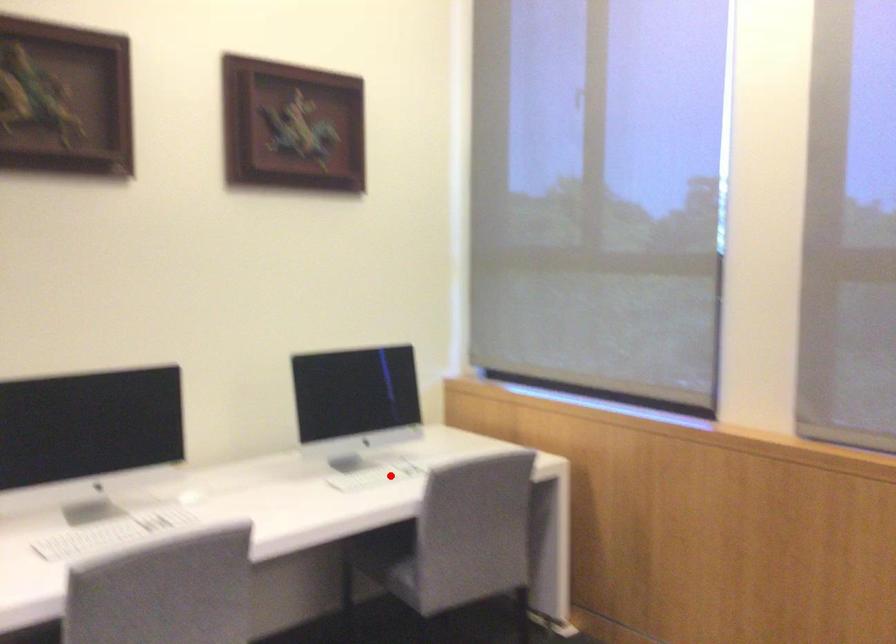
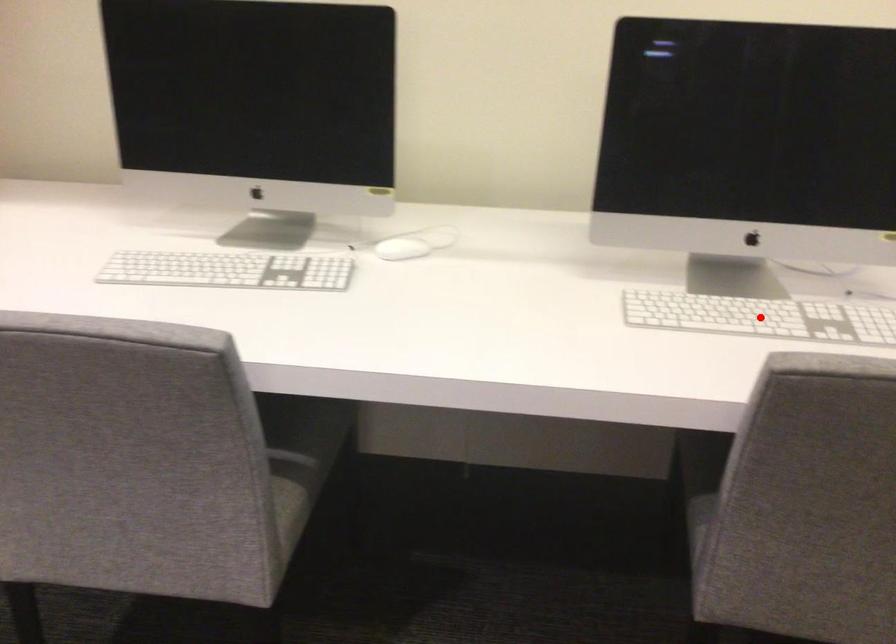
I am providing you with two images of the same scene from different viewpoints. A red point is marked on the first image and another point is marked on the second image. Do the highlighted points in image1 and image2 indicate the same real-world spot?

Yes